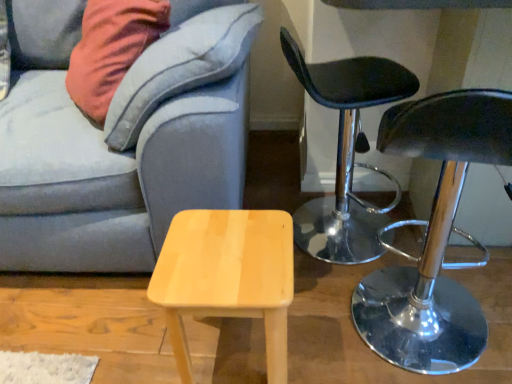
Locate an element on the screen. The width and height of the screenshot is (512, 384). vacant area situated below shiny chrome stool at right, which ranks as the second chair in back-to-front order (from a real-world perspective) is located at coordinates (438, 347).